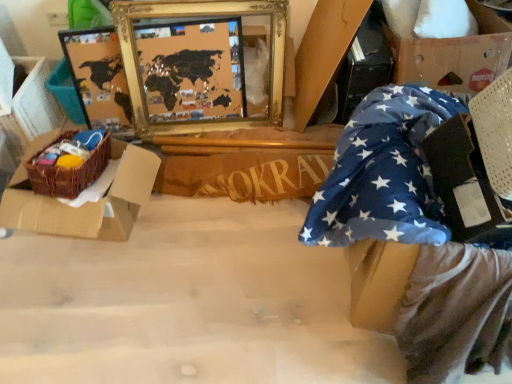
Identify the location of free space on the front side of gold-framed map at upper center. The image size is (512, 384). (227, 229).